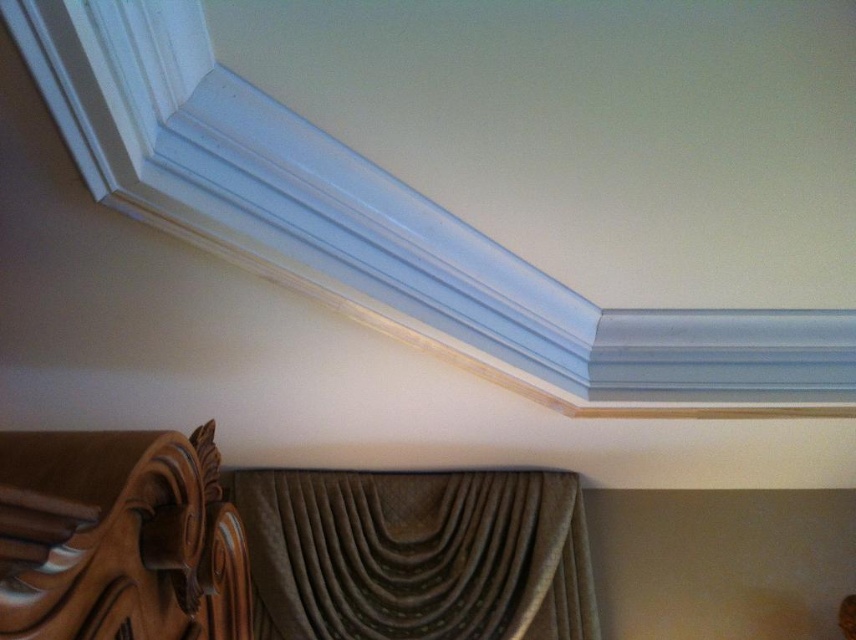
Consider the image. You are standing in front of the wall corner and want to place a small decorative item. You have two points marked on the wall at coordinates point [181,68] and point [48,509]. Which point is closer to you?

Point [181,68] is further to the viewer than point [48,509]. Therefore, point [181,68] is closer to you.

You are an interior designer assessing the placement of a new wall decor piece. You notice the point at coordinates (387, 232) on the wall. What architectural feature is located at that specific point?

The white smooth crown molding at upper center is located at point (387, 232).

You are an interior designer assessing the wall corner. You need to determine the vertical arrangement of the white smooth crown molding at upper center and the brown textured curtain at upper center. Which one is positioned higher?

The white smooth crown molding at upper center is located above the brown textured curtain at upper center, so it is positioned higher.